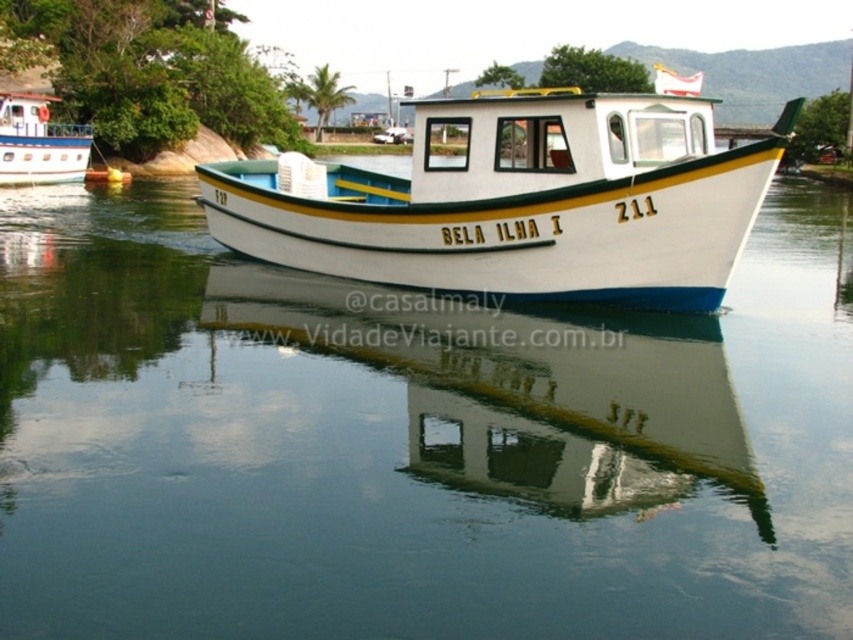
Is the position of smooth water at center less distant than that of white glossy boat at upper left?

That is True.

Who is higher up, smooth water at center or white glossy boat at upper left?

Positioned higher is white glossy boat at upper left.

What do you see at coordinates (410, 444) in the screenshot?
I see `smooth water at center` at bounding box center [410, 444].

Locate an element on the screen. This screenshot has height=640, width=853. smooth water at center is located at coordinates (410, 444).

Can you confirm if smooth water at center is taller than white glossy boat at center?

No.

Which is in front, point (20, 417) or point (584, 264)?

Point (20, 417)

Who is more forward, (820, 504) or (595, 184)?

Point (820, 504)

Image resolution: width=853 pixels, height=640 pixels. Identify the location of smooth water at center. (410, 444).

The height and width of the screenshot is (640, 853). What do you see at coordinates (519, 200) in the screenshot?
I see `white glossy boat at center` at bounding box center [519, 200].

Between point (405, 236) and point (53, 161), which one is positioned behind?

The point (53, 161) is more distant.

Locate an element on the screen. Image resolution: width=853 pixels, height=640 pixels. white glossy boat at center is located at coordinates (519, 200).